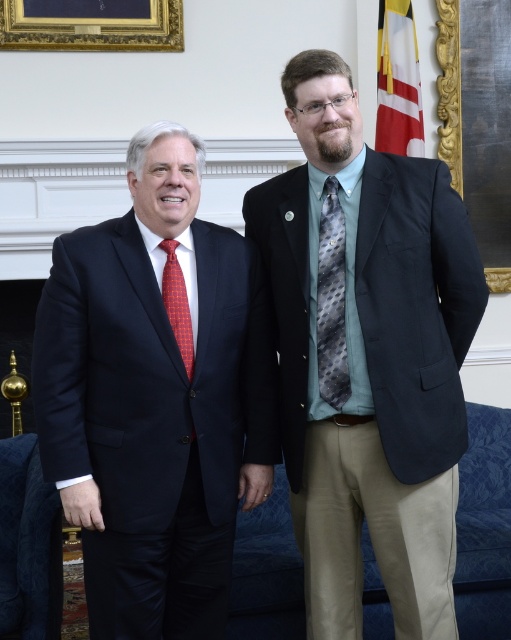
Question: Does navy blue suit at left lie in front of red dotted tie at left?

Choices:
 (A) yes
 (B) no

Answer: (A)

Question: Which object appears farthest from the camera in this image?

Choices:
 (A) white fabric flag at upper right
 (B) matte black blazer at center

Answer: (A)

Question: Which of the following is the farthest from the observer?

Choices:
 (A) gray dotted fabric tie at center
 (B) white fabric flag at upper right
 (C) navy blue suit at left

Answer: (B)

Question: Which of the following is the closest to the observer?

Choices:
 (A) (394, 44)
 (B) (328, 236)
 (C) (252, 198)

Answer: (B)

Question: Is goldwooden frame at upper center positioned before red dotted tie at left?

Choices:
 (A) yes
 (B) no

Answer: (B)

Question: Is goldwooden frame at upper center thinner than white fabric flag at upper right?

Choices:
 (A) no
 (B) yes

Answer: (A)